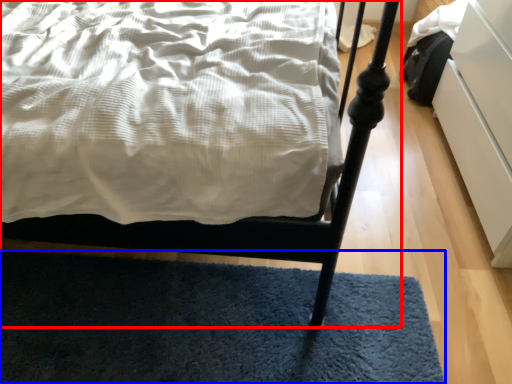
Question: Which object appears farthest to the camera in this image, bed (highlighted by a red box) or mat (highlighted by a blue box)?

Choices:
 (A) bed
 (B) mat

Answer: (B)